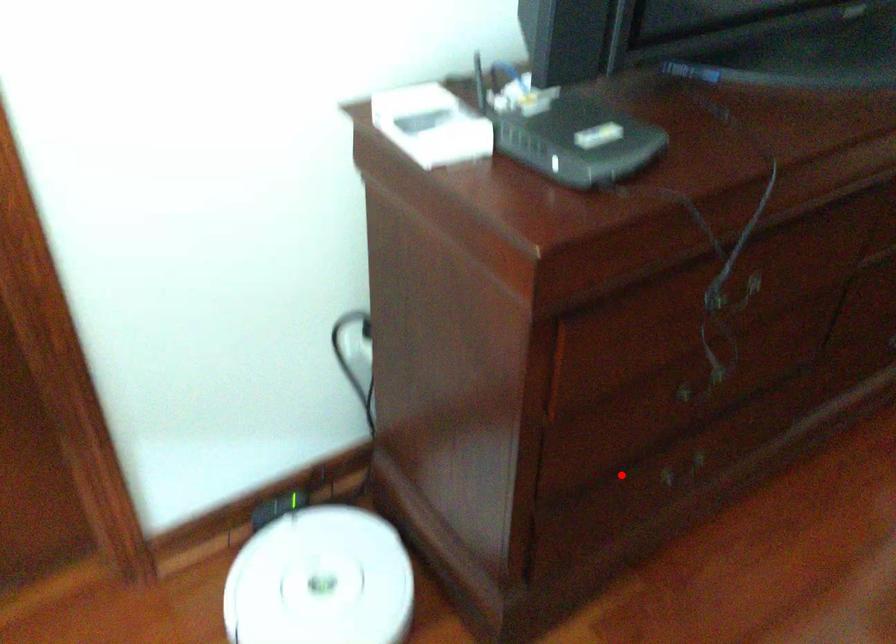
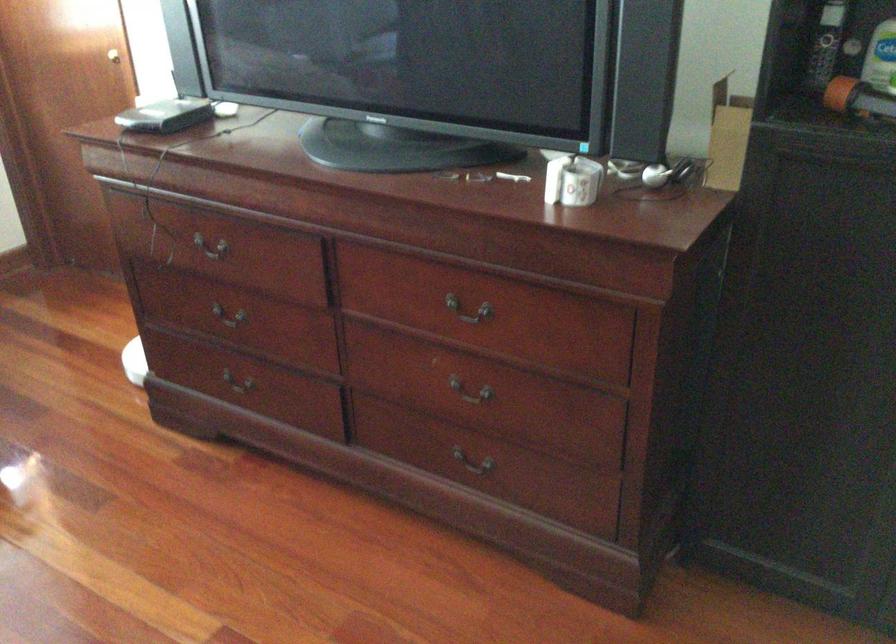
Question: A red point is marked in image1. In image2, is the corresponding 3D point closer to the camera or farther? Reply with the corresponding letter.

Choices:
 (A) The corresponding 3D point is closer.
 (B) The corresponding 3D point is farther.

Answer: (B)